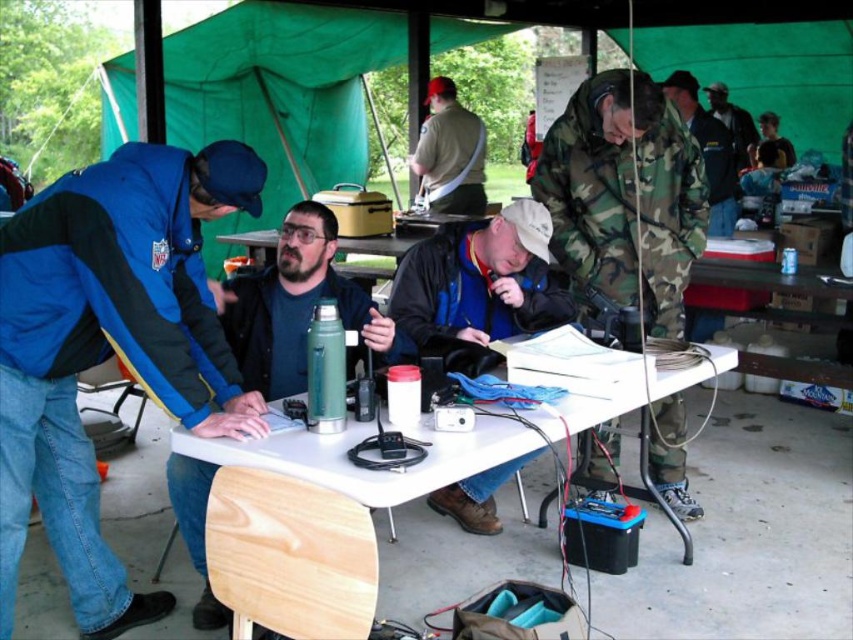
Is white plastic table at center below green matte thermos at center?

Yes.

Between white plastic table at center and green matte thermos at center, which one has more height?

With more height is white plastic table at center.

The image size is (853, 640). What do you see at coordinates (456, 435) in the screenshot? I see `white plastic table at center` at bounding box center [456, 435].

Find the location of `white plastic table at center`. white plastic table at center is located at coordinates (456, 435).

Is point (543, 317) in front of point (717, 115)?

Yes, it is.

The width and height of the screenshot is (853, 640). In order to click on matte black jacket at center in this screenshot , I will do `click(480, 280)`.

Between blue fleece jacket at left and matte black jacket at center, which one has more height?

Standing taller between the two is blue fleece jacket at left.

Does blue fleece jacket at left have a lesser width compared to matte black jacket at center?

No.

Is point (199, 289) more distant than point (490, 499)?

No, (199, 289) is in front of (490, 499).

In order to click on blue fleece jacket at left in this screenshot , I will do `click(109, 348)`.